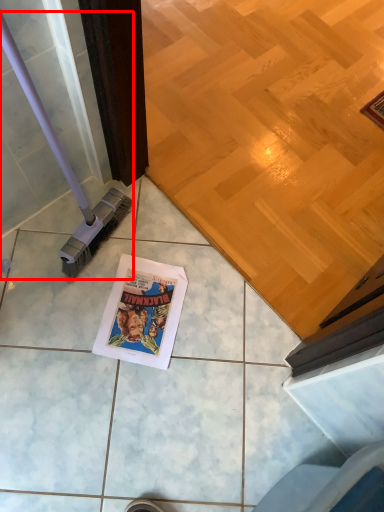
Question: From the image's perspective, where is brush (annotated by the red box) located relative to comic book?

Choices:
 (A) below
 (B) above

Answer: (B)